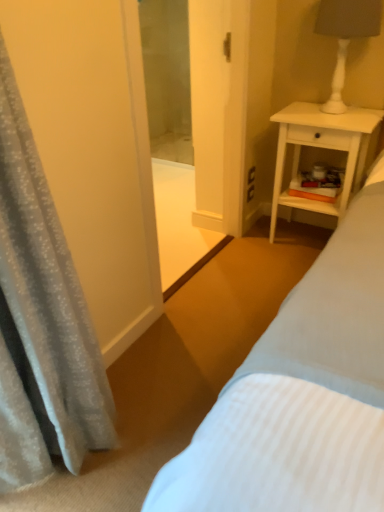
Question: Does white matte lamp at upper right have a larger size compared to silky gray curtain at left?

Choices:
 (A) no
 (B) yes

Answer: (A)

Question: Are white matte lamp at upper right and silky gray curtain at left far apart?

Choices:
 (A) no
 (B) yes

Answer: (B)

Question: Does white matte lamp at upper right appear on the left side of silky gray curtain at left?

Choices:
 (A) no
 (B) yes

Answer: (A)

Question: From the image's perspective, is white matte lamp at upper right located above silky gray curtain at left?

Choices:
 (A) yes
 (B) no

Answer: (A)

Question: Does white matte lamp at upper right have a smaller size compared to silky gray curtain at left?

Choices:
 (A) yes
 (B) no

Answer: (A)

Question: Is white matte lamp at upper right oriented away from silky gray curtain at left?

Choices:
 (A) yes
 (B) no

Answer: (B)

Question: From the image's perspective, is silky gray curtain at left over white matte lamp at upper right?

Choices:
 (A) no
 (B) yes

Answer: (A)

Question: Is silky gray curtain at left facing towards white matte lamp at upper right?

Choices:
 (A) yes
 (B) no

Answer: (B)

Question: From a real-world perspective, does silky gray curtain at left sit lower than white matte lamp at upper right?

Choices:
 (A) no
 (B) yes

Answer: (B)

Question: Is white matte lamp at upper right at the back of silky gray curtain at left?

Choices:
 (A) no
 (B) yes

Answer: (A)

Question: Can you confirm if silky gray curtain at left is smaller than white matte lamp at upper right?

Choices:
 (A) yes
 (B) no

Answer: (B)

Question: Can you confirm if silky gray curtain at left is wider than white matte lamp at upper right?

Choices:
 (A) no
 (B) yes

Answer: (A)

Question: Can you confirm if silky gray curtain at left is taller than transparent glass screen door at center?

Choices:
 (A) no
 (B) yes

Answer: (A)